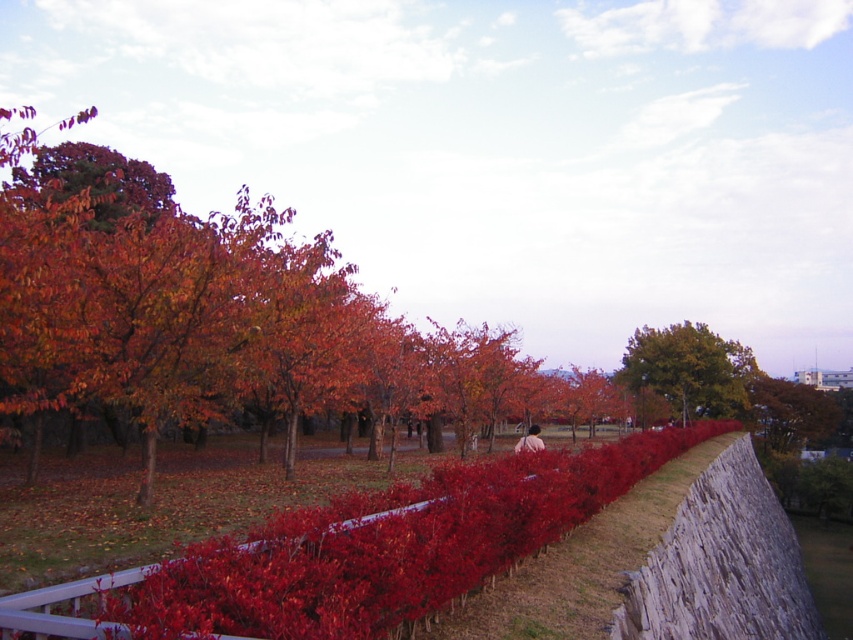
You are standing at the entrance of the park and want to take a photo of both the bright red hedge at center and the green leafy tree at upper right. Which object should you focus on first to ensure both are in clear view?

You should focus on the bright red hedge at center first because it is closer to you than the green leafy tree at upper right, ensuring both are in focus when using a camera with a fixed focal point.

You are a gardener planning to water the bright red hedge at center and the green leafy tree at upper right. Which of these two plants is closer to the left edge of the garden path?

The bright red hedge at center is positioned on the left side of the green leafy tree at upper right, so it is closer to the left edge of the garden path.

You are planning to plant a new tree in the park and need to know which area has more space. Based on the image, which object takes up more space between the bright red hedge at center and the green leafy tree at upper right?

The green leafy tree at upper right takes up more space than the bright red hedge at center.